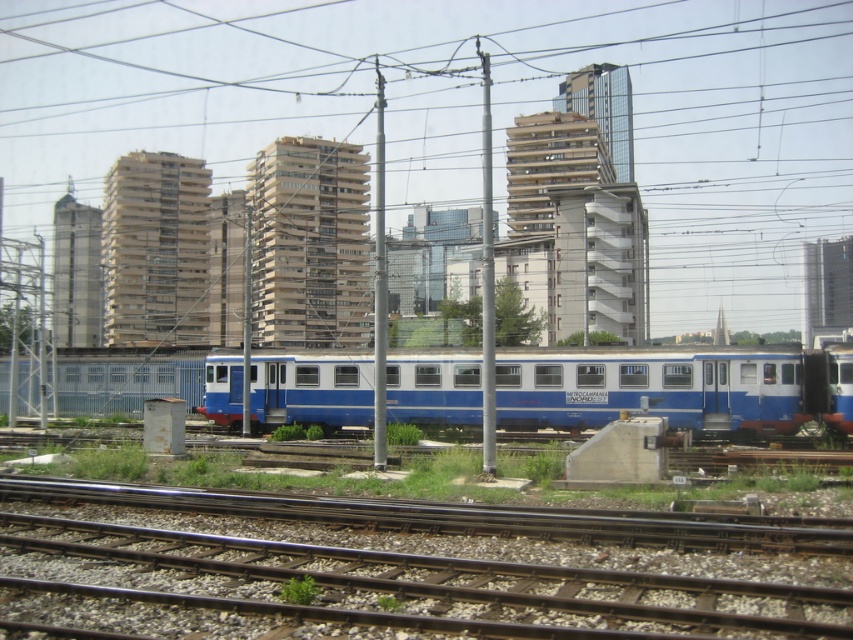
Is smooth steel tracks at center positioned in front of blue/white passenger train at center?

Yes, smooth steel tracks at center is in front of blue/white passenger train at center.

Does point (161, 554) come closer to viewer compared to point (421, 396)?

Yes.

Describe the element at coordinates (378, 588) in the screenshot. I see `smooth steel tracks at center` at that location.

Locate an element on the screen. The height and width of the screenshot is (640, 853). smooth steel tracks at center is located at coordinates (378, 588).